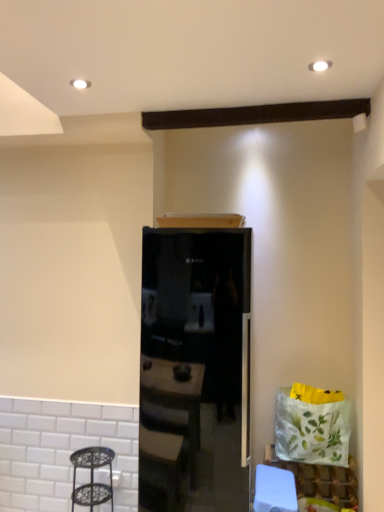
Question: Looking at their shapes, would you say black glass refrigerator at center is wider or thinner than white paper bag at lower right?

Choices:
 (A) thin
 (B) wide

Answer: (B)

Question: From the image's perspective, relative to white paper bag at lower right, is black glass refrigerator at center above or below?

Choices:
 (A) below
 (B) above

Answer: (B)

Question: Considering the real-world distances, which object is farthest from the black glass refrigerator at center?

Choices:
 (A) white paper bag at lower right
 (B) metallic black step stool at lower left

Answer: (A)

Question: Which object is positioned farthest from the metallic black step stool at lower left?

Choices:
 (A) white paper bag at lower right
 (B) black glass refrigerator at center

Answer: (A)